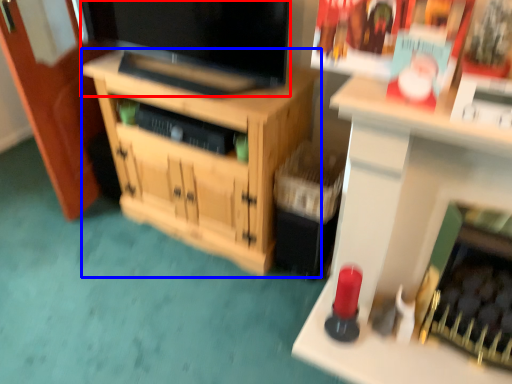
Question: Among these objects, which one is nearest to the camera, television (highlighted by a red box) or cabinetry (highlighted by a blue box)?

Choices:
 (A) television
 (B) cabinetry

Answer: (A)